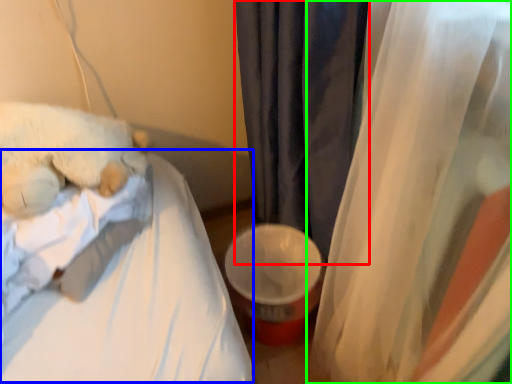
Question: Which object is positioned farthest from curtain (highlighted by a red box)? Select from mattress (highlighted by a blue box) and curtain (highlighted by a green box).

Choices:
 (A) mattress
 (B) curtain

Answer: (A)